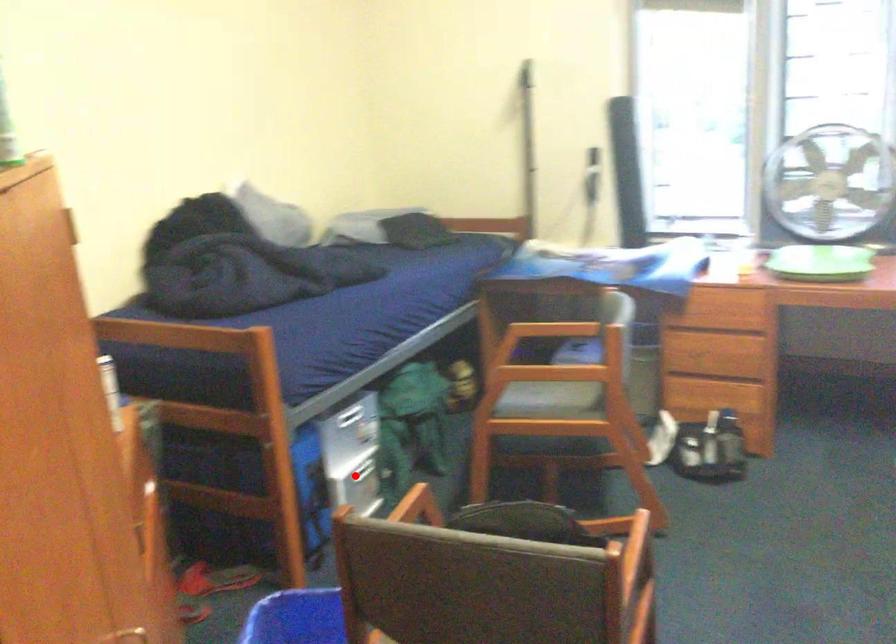
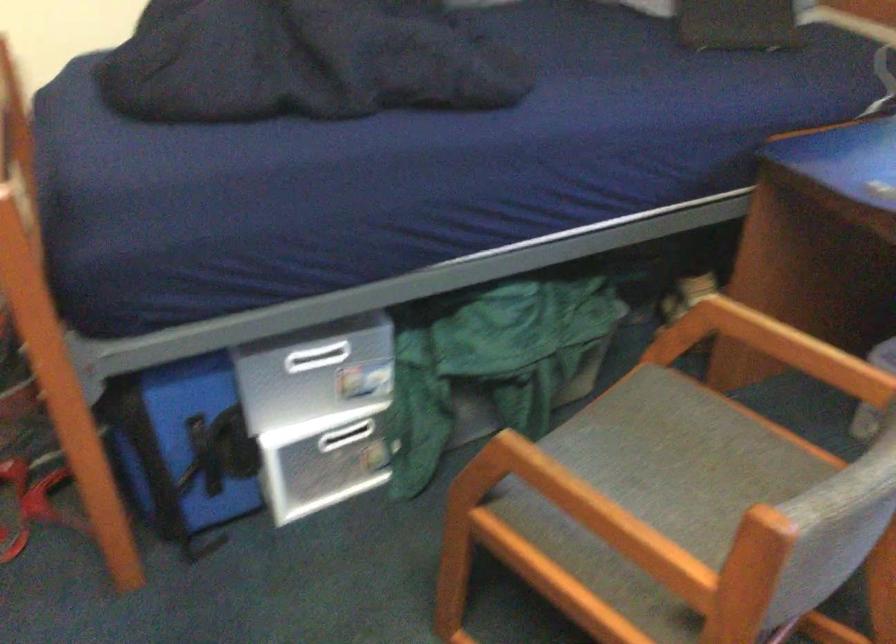
Find the pixel in the second image that matches the highlighted location in the first image.

(345, 436)